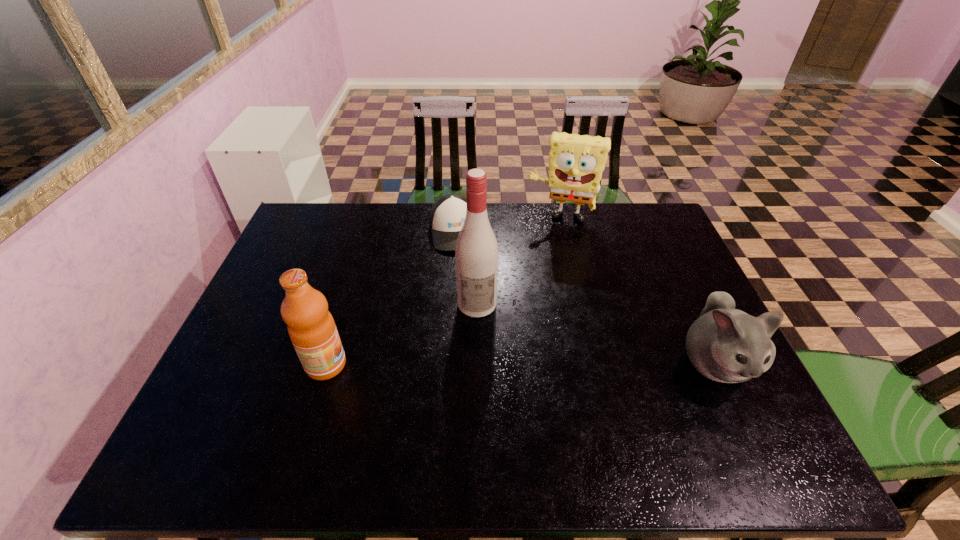
Where is `vacant space situated on the face of the sponge`? This screenshot has width=960, height=540. vacant space situated on the face of the sponge is located at coordinates (548, 258).

At what (x,y) coordinates should I click in order to perform the action: click on free space located on the front panel of the shortest object. Please return your answer as a coordinate pair (x, y). The width and height of the screenshot is (960, 540). Looking at the image, I should click on (469, 306).

The image size is (960, 540). I want to click on vacant space situated 0.090m on the front panel of the shortest object, so click(x=462, y=273).

Find the location of a particular element. This screenshot has width=960, height=540. vacant region located on the front panel of the shortest object is located at coordinates (473, 325).

The image size is (960, 540). I want to click on vacant space positioned 0.150m on the label of the third farthest object, so click(481, 364).

Image resolution: width=960 pixels, height=540 pixels. I want to click on free location located on the label of the third farthest object, so click(482, 379).

Locate an element on the screen. free space located on the label of the third farthest object is located at coordinates (480, 352).

Where is `sponge located at the far edge`? sponge located at the far edge is located at coordinates (576, 163).

You are a GUI agent. You are given a task and a screenshot of the screen. Output one action in this format:
    pyautogui.click(x=<x>, y=<y>)
    Task: Click on the cap that is at the far edge
    The height and width of the screenshot is (540, 960).
    Given the screenshot: What is the action you would take?
    pyautogui.click(x=448, y=213)

The image size is (960, 540). What are the coordinates of `object located at the near edge` in the screenshot? It's located at coord(724,344).